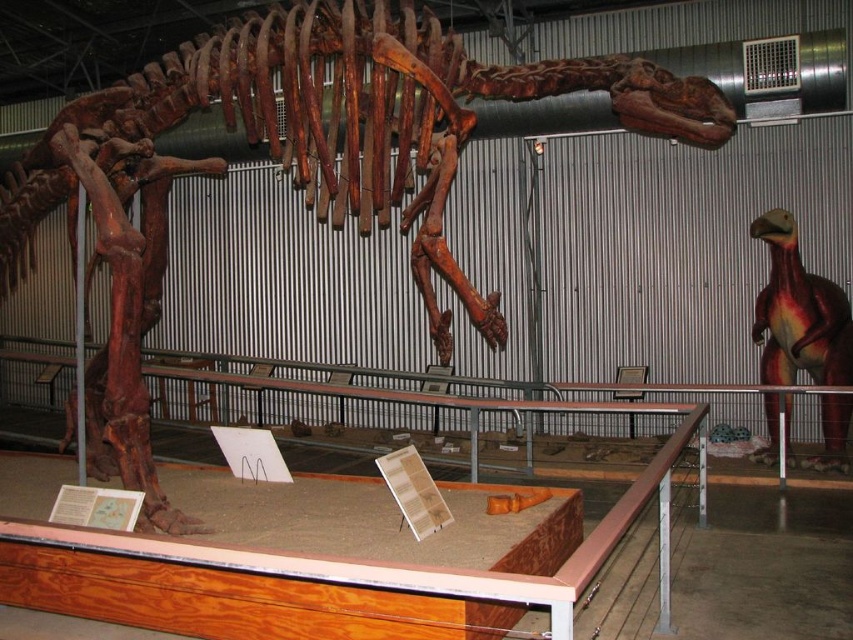
You are standing in front of the museum exhibit and want to know how far you are from the point marked at coordinates point (97, 147). Can you determine the distance?

The point (97, 147) is 3.73 meters from the camera, so you are 3.73 meters away from it.

Looking at this image, you are a visitor standing in front of the wooden dinosaur skeleton at center and the smooth red dinosaur at right. Which dinosaur is closer to you?

The wooden dinosaur skeleton at center is closer to the viewer than the smooth red dinosaur at right.